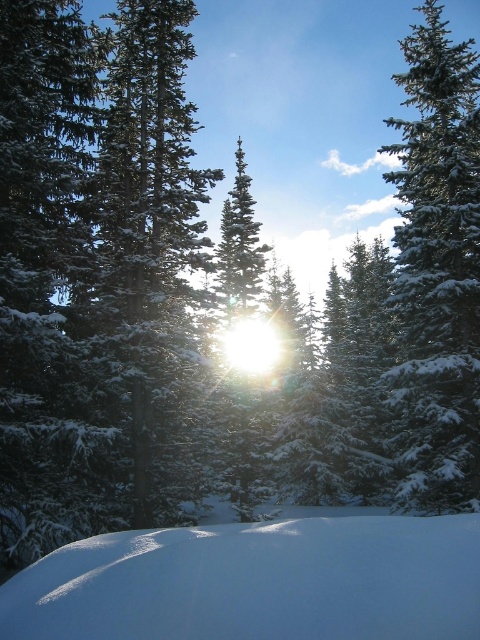
Question: Is white fluffy snow at lower center positioned before green matte tree at center?

Choices:
 (A) yes
 (B) no

Answer: (A)

Question: Considering the relative positions of green matte tree at center and green snow-covered tree at right in the image provided, where is green matte tree at center located with respect to green snow-covered tree at right?

Choices:
 (A) below
 (B) above

Answer: (A)

Question: Which of these objects is positioned closest to the white fluffy snow at lower center?

Choices:
 (A) green snow-covered tree at right
 (B) green matte tree at center

Answer: (A)

Question: Which of the following is the closest to the observer?

Choices:
 (A) white fluffy snow at lower center
 (B) green snow-covered tree at right
 (C) green matte tree at center

Answer: (A)

Question: Estimate the real-world distances between objects in this image. Which object is farther from the green matte tree at center?

Choices:
 (A) green snow-covered tree at right
 (B) white fluffy snow at lower center

Answer: (A)

Question: Is white fluffy snow at lower center thinner than green matte tree at center?

Choices:
 (A) yes
 (B) no

Answer: (A)